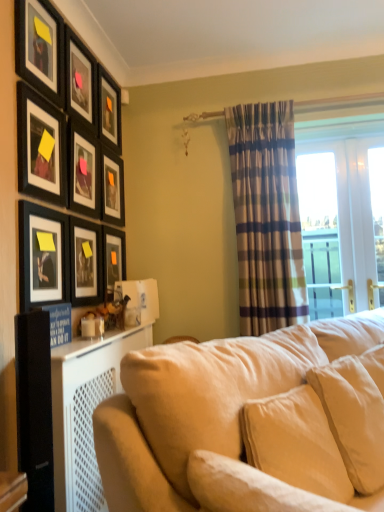
Question: Is beige velvety pillow at center, positioned as the 2th pillow in front-to-back order, spatially inside matte black picture frame at upper left, which is counted as the sixth picture frame, starting from the bottom, or outside of it?

Choices:
 (A) inside
 (B) outside

Answer: (B)

Question: Based on their positions, is beige velvety pillow at center, positioned as the 2th pillow in front-to-back order, located to the left or right of matte black picture frame at upper left, the fourth picture frame when ordered from top to bottom?

Choices:
 (A) left
 (B) right

Answer: (B)

Question: Which object is the closest to the matte black picture frame at upper left, which is counted as the sixth picture frame, starting from the bottom?

Choices:
 (A) matte black picture frame at upper left, which appears as the 2th picture frame when viewed from the top
 (B) matte black picture frame at upper left, the third picture frame positioned from the top
 (C) matte black picture frame at left, the 8th picture frame viewed from the top
 (D) beige fabric pillow at lower right, acting as the 1th pillow starting from the front
 (E) matte black picture frame at upper left, acting as the 4th picture frame starting from the bottom

Answer: (A)

Question: Which object is the farthest from the matte black picture frame at upper left, the fifth picture frame positioned from the top?

Choices:
 (A) matte black picture frame at upper left, which is counted as the sixth picture frame, starting from the bottom
 (B) beige velvety pillow at center, positioned as the 2th pillow in front-to-back order
 (C) beige fabric couch at lower right
 (D) matte black picture frame at upper left, the third picture frame positioned from the top
 (E) matte black picture frame at upper left, which appears as the 2th picture frame when viewed from the top

Answer: (B)